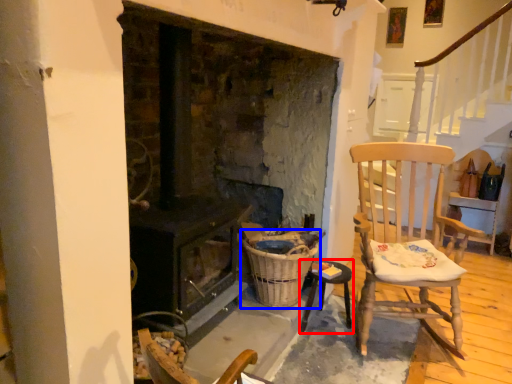
Question: Which point is further to the camera, table (highlighted by a red box) or basket (highlighted by a blue box)?

Choices:
 (A) table
 (B) basket

Answer: (A)